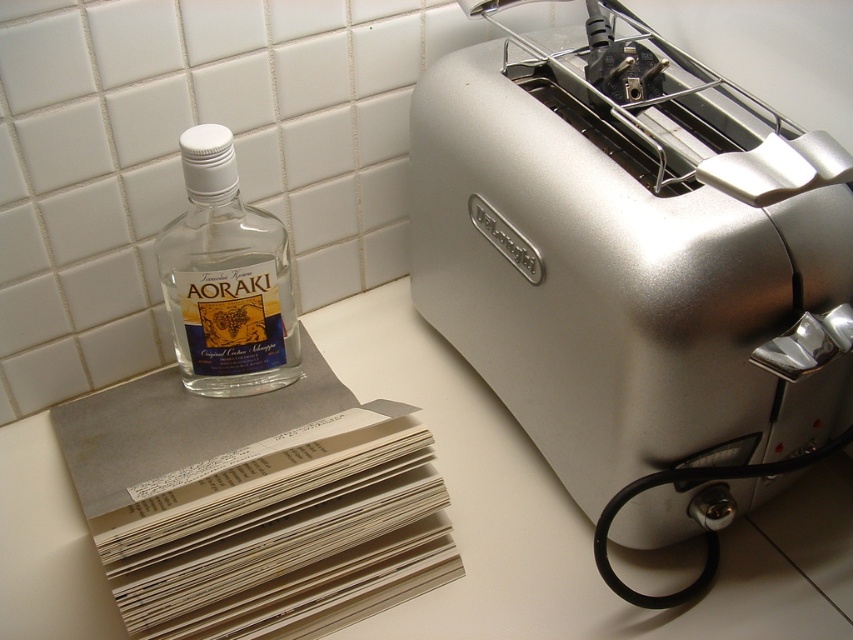
Question: Is satin silver toaster at right to the left of transparent glass bottle at left from the viewer's perspective?

Choices:
 (A) no
 (B) yes

Answer: (A)

Question: Is satin silver toaster at right below transparent glass bottle at left?

Choices:
 (A) yes
 (B) no

Answer: (B)

Question: Which object is closer to the camera taking this photo?

Choices:
 (A) satin silver toaster at right
 (B) transparent glass bottle at left

Answer: (A)

Question: Can you confirm if satin silver toaster at right is positioned above transparent glass bottle at left?

Choices:
 (A) yes
 (B) no

Answer: (A)

Question: Which of the following is the farthest from the observer?

Choices:
 (A) satin silver toaster at right
 (B) transparent glass bottle at left

Answer: (B)